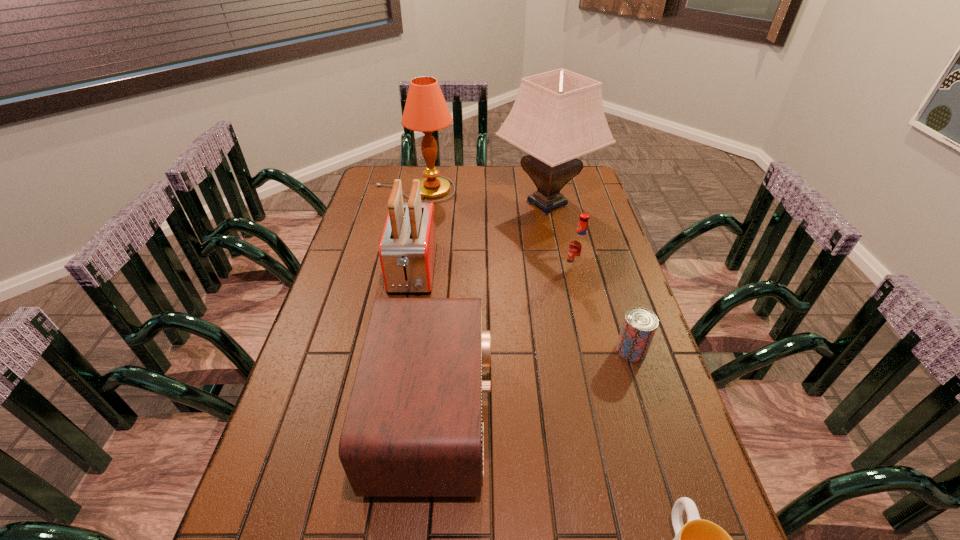
Where is `lampshade`? The width and height of the screenshot is (960, 540). lampshade is located at coordinates (558, 116).

This screenshot has width=960, height=540. Identify the location of lamp. (426, 111).

The image size is (960, 540). Identify the location of the third tallest object. (407, 250).

This screenshot has height=540, width=960. Identify the location of root beer. (578, 250).

Where is `radio receiver`? The height and width of the screenshot is (540, 960). radio receiver is located at coordinates (413, 428).

At what (x,y) coordinates should I click in order to perform the action: click on beer can. Please return your answer as a coordinate pair (x, y). The height and width of the screenshot is (540, 960). Looking at the image, I should click on (639, 326).

This screenshot has width=960, height=540. Identify the location of vacant space located 0.180m on the left of the lampshade. (447, 204).

At what (x,y) coordinates should I click in order to perform the action: click on free space located on the right of the lamp. Please return your answer as a coordinate pair (x, y). Looking at the image, I should click on (540, 190).

Locate an element on the screen. Image resolution: width=960 pixels, height=540 pixels. blank space located 0.140m on the front-facing side of the toaster is located at coordinates (401, 338).

This screenshot has height=540, width=960. Find the location of `free space located 0.250m on the back of the root beer`. free space located 0.250m on the back of the root beer is located at coordinates (563, 221).